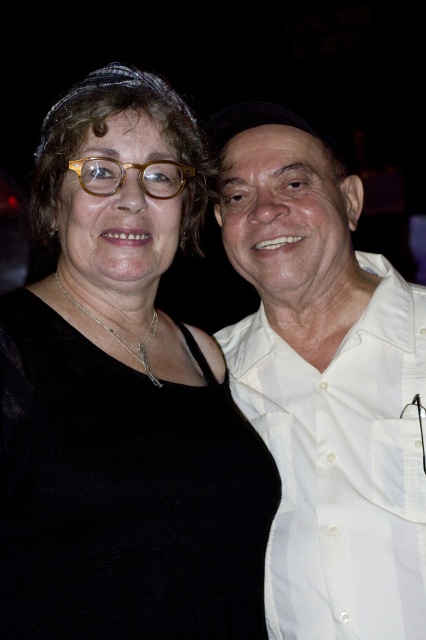
You are a photographer setting up a camera to capture the scene described. You need to ensure that both the black velvet top at center and the tortoiseshell frame glasses at upper center are clearly visible in the photo. Based on their sizes, which object should you focus on first to ensure proper framing?

The black velvet top at center is wider than the tortoiseshell frame glasses at upper center, so you should focus on the black velvet top at center first to ensure it fits within the frame.

You are trying to decide which item to grab first from the scene. Since you can only reach items taller than 15 cm, can you take the white cotton shirt at right before the tortoiseshell frame glasses at upper center?

The white cotton shirt at right has a greater height compared to tortoiseshell frame glasses at upper center. Since the shirt is taller, it is likely over 15 cm, so you can take it first.

You are a fashion designer observing two outfits in the image. The black velvet top at center and the white cotton shirt at right are part of a new collection. Which outfit appears shorter in the image?

The black velvet top at center is not as tall as the white cotton shirt at right, so the black velvet top at center appears shorter.